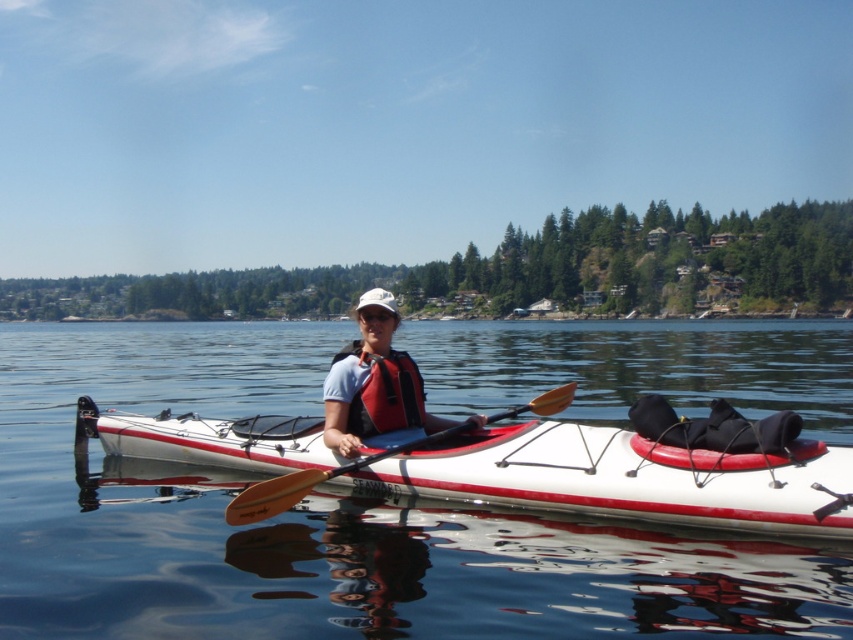
Question: Is white glossy kayak at center closer to the viewer compared to wooden smooth paddle at center?

Choices:
 (A) yes
 (B) no

Answer: (B)

Question: Which object appears farthest from the camera in this image?

Choices:
 (A) white glossy kayak at center
 (B) orange life jacket at center

Answer: (A)

Question: Which is farther from the wooden smooth paddle at center?

Choices:
 (A) white glossy kayak at center
 (B) transparent water at center
 (C) orange life jacket at center
 (D) white matte life vest at center

Answer: (B)

Question: In this image, where is white glossy kayak at center located relative to orange life jacket at center?

Choices:
 (A) left
 (B) right

Answer: (B)

Question: Considering the relative positions of white matte life vest at center and wooden smooth paddle at center in the image provided, where is white matte life vest at center located with respect to wooden smooth paddle at center?

Choices:
 (A) left
 (B) right

Answer: (A)

Question: Which point is closer to the camera?

Choices:
 (A) (270, 484)
 (B) (288, 440)
 (C) (381, 340)
 (D) (850, 572)

Answer: (D)